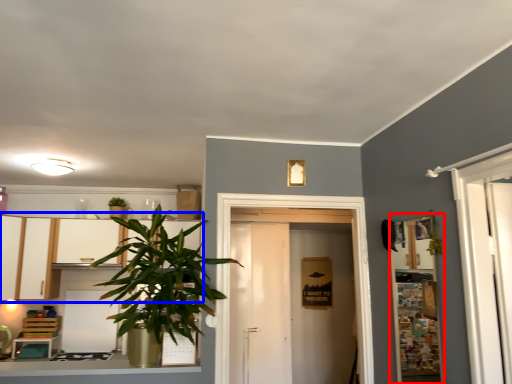
Question: Which of the following is the closest to the observer, shelf (highlighted by a red box) or dresser (highlighted by a blue box)?

Choices:
 (A) shelf
 (B) dresser

Answer: (A)